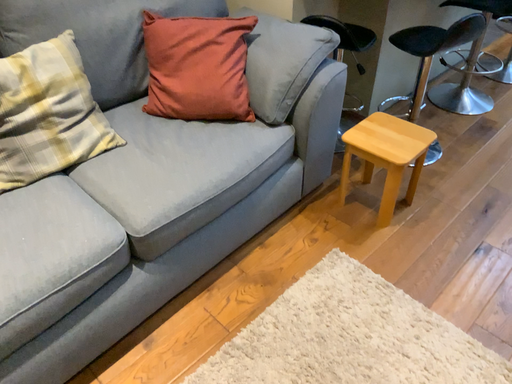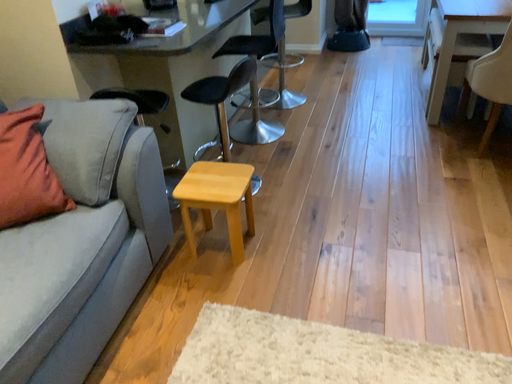
Question: Which way did the camera rotate in the video?

Choices:
 (A) rotated downward
 (B) rotated upward

Answer: (B)